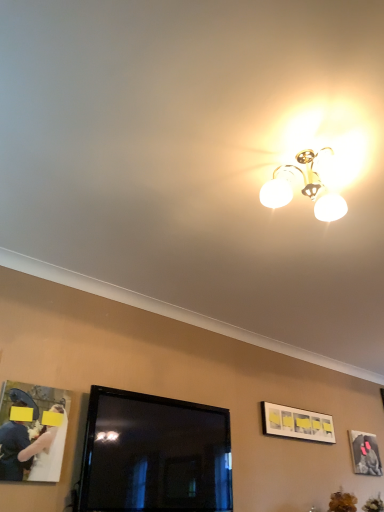
Question: Does white matte picture frame at upper right, the 1th picture frame viewed from the left, have a lesser width compared to white satin dress at lower left?

Choices:
 (A) no
 (B) yes

Answer: (A)

Question: Does white matte picture frame at upper right, the second picture frame viewed from the right, have a lesser height compared to white satin dress at lower left?

Choices:
 (A) yes
 (B) no

Answer: (A)

Question: From a real-world perspective, is white matte picture frame at upper right, the second picture frame viewed from the right, on top of white satin dress at lower left?

Choices:
 (A) no
 (B) yes

Answer: (B)

Question: Considering the relative positions of white matte picture frame at upper right, placed as the first picture frame when sorted from front to back, and white satin dress at lower left in the image provided, is white matte picture frame at upper right, placed as the first picture frame when sorted from front to back, in front of white satin dress at lower left?

Choices:
 (A) yes
 (B) no

Answer: (B)

Question: From the image's perspective, is white matte picture frame at upper right, positioned as the second picture frame in bottom-to-top order, located beneath white satin dress at lower left?

Choices:
 (A) no
 (B) yes

Answer: (B)

Question: Looking at their shapes, would you say white matte picture frame at upper right, marked as the first picture frame in a top-to-bottom arrangement, is wider or thinner than white satin dress at lower left?

Choices:
 (A) thin
 (B) wide

Answer: (B)

Question: Considering their positions, is white matte picture frame at upper right, marked as the first picture frame in a top-to-bottom arrangement, located in front of or behind white satin dress at lower left?

Choices:
 (A) front
 (B) behind

Answer: (B)

Question: Would you say white matte picture frame at upper right, marked as the first picture frame in a top-to-bottom arrangement, is inside or outside white satin dress at lower left?

Choices:
 (A) inside
 (B) outside

Answer: (B)

Question: Is point (284, 406) closer or farther from the camera than point (46, 454)?

Choices:
 (A) closer
 (B) farther

Answer: (B)

Question: From a real-world perspective, is black glossy tv at center above or below white satin dress at lower left?

Choices:
 (A) below
 (B) above

Answer: (A)

Question: Based on their positions, is black glossy tv at center located to the left or right of white satin dress at lower left?

Choices:
 (A) left
 (B) right

Answer: (B)

Question: In terms of width, does black glossy tv at center look wider or thinner when compared to white satin dress at lower left?

Choices:
 (A) thin
 (B) wide

Answer: (B)

Question: Considering the positions of black glossy tv at center and white satin dress at lower left in the image, is black glossy tv at center bigger or smaller than white satin dress at lower left?

Choices:
 (A) big
 (B) small

Answer: (A)

Question: From their relative heights in the image, would you say matte black picture frame at upper right, which appears as the second picture frame when viewed from the left, is taller or shorter than black glossy tv at center?

Choices:
 (A) short
 (B) tall

Answer: (A)

Question: From the image's perspective, is matte black picture frame at upper right, the first picture frame in the right-to-left sequence, positioned above or below black glossy tv at center?

Choices:
 (A) above
 (B) below

Answer: (B)